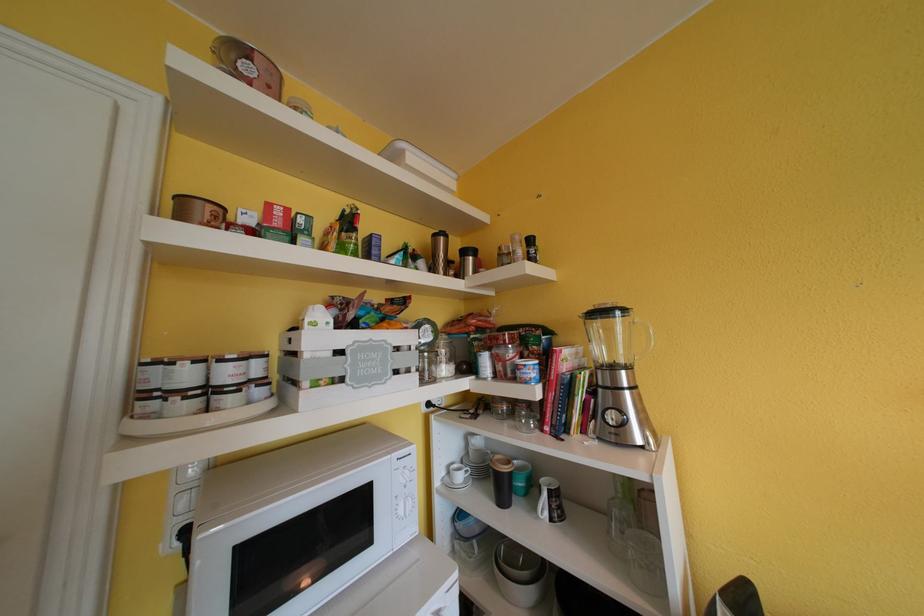
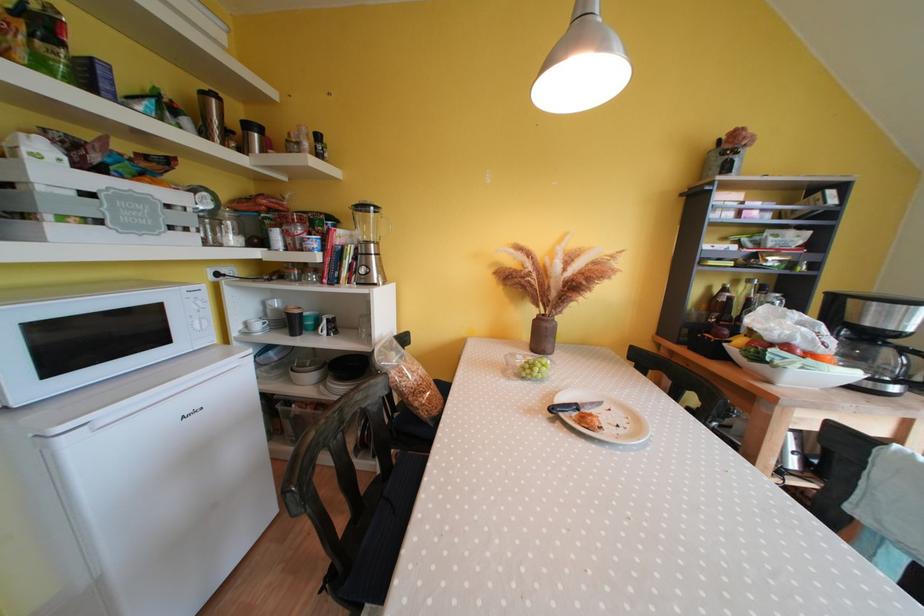
Locate, in the second image, the point that corresponds to (469,256) in the first image.

(252, 130)